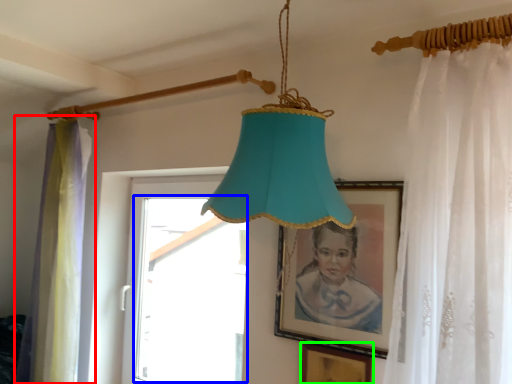
Question: Which object is positioned farthest from curtain (highlighted by a red box)? Select from window (highlighted by a blue box) and picture frame (highlighted by a green box).

Choices:
 (A) window
 (B) picture frame

Answer: (B)